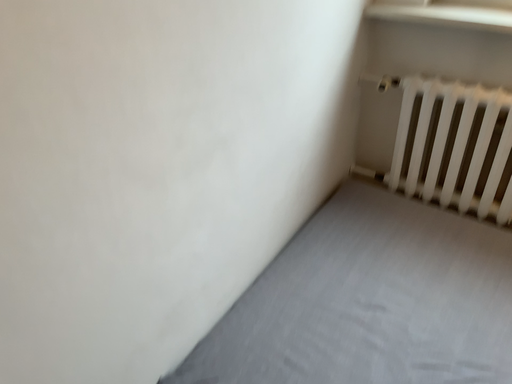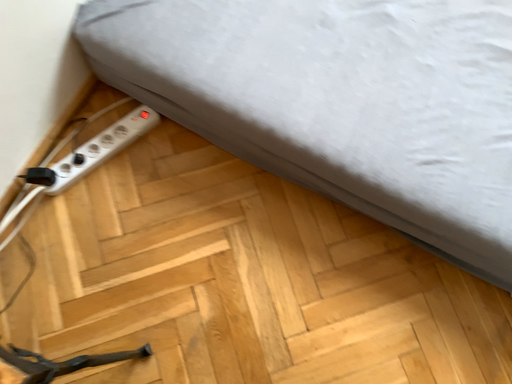
Question: Which way did the camera rotate in the video?

Choices:
 (A) rotated upward
 (B) rotated downward

Answer: (B)